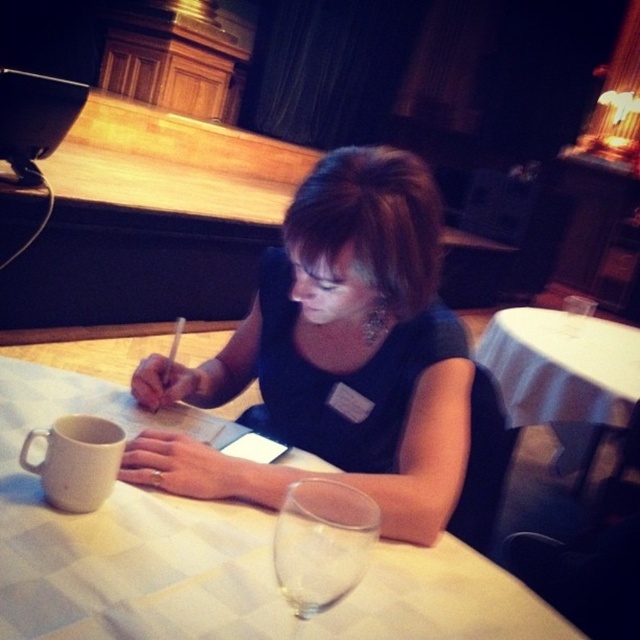
You are a server in a conference room. You need to place a 7.5 inch wide dessert plate on the table between the white checkered tablecloth at center and the white matte mug at lower left. Will there be enough space?

The distance between the white checkered tablecloth at center and the white matte mug at lower left is 7.38 inches, which is slightly less than the 7.5 inch wide dessert plate. Therefore, there is not enough space to place the dessert plate between them without overlapping.

You are organizing a meeting and need to place a new folder on the table. The folder is 10 cm in height. The white checkered tablecloth at center and transparent glass at table are already present. Can you place the folder on the table without it overlapping the glass?

The white checkered tablecloth at center is below the transparent glass at table, so the folder can be placed on the tablecloth area not covered by the glass.

You are a caterer preparing to place a new dish on the table. The dish requires a space of 10 inches to be placed between the white checkered tablecloth at center and the transparent glass at table. Is there enough space?

The distance between the white checkered tablecloth at center and the transparent glass at table is 9.45 inches, which is less than the required 10 inches. Therefore, there is not enough space to place the dish.